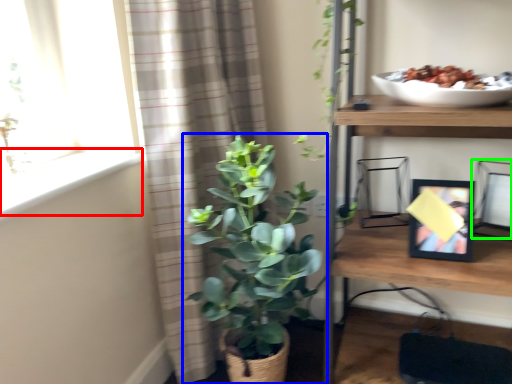
Question: Which object is the closest to the window sill (highlighted by a red box)? Choose among these: houseplant (highlighted by a blue box) or picture frame (highlighted by a green box).

Choices:
 (A) houseplant
 (B) picture frame

Answer: (A)